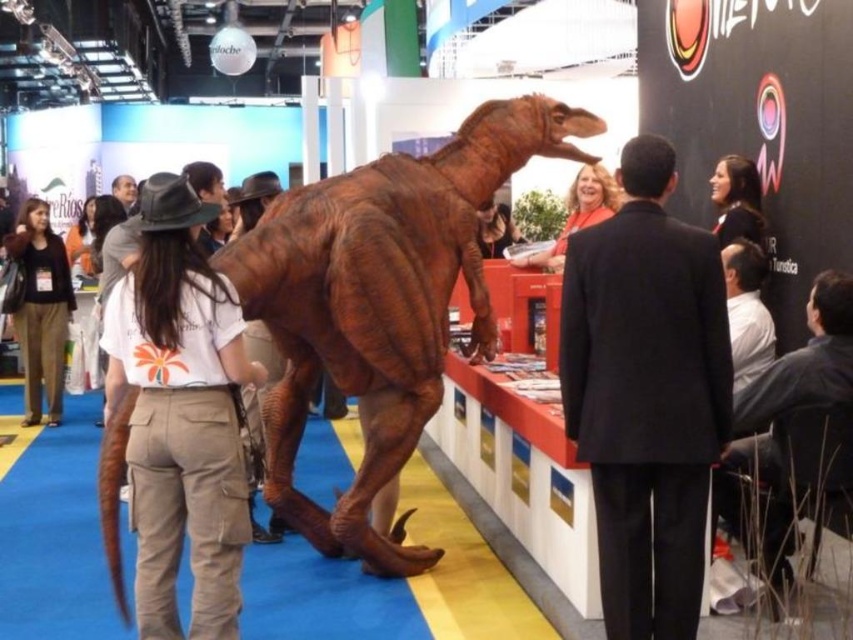
In the scene shown: You are at the exhibition and want to take a photo of the brown matte dinosaur tail at lower left and the matte black shirt at upper right. Which object should you focus on first if you want to capture both in the same frame without moving the camera?

The brown matte dinosaur tail at lower left is taller than the matte black shirt at upper right, so you should focus on the brown matte dinosaur tail at lower left first to ensure it fits in the frame.

You are organizing a photo shoot and need to ensure that both the brown textured dinosaur at center and the black suit at center can fit side by side within a 3 meter wide backdrop. Based on their widths, will they fit?

The brown textured dinosaur at center is wider than the black suit at center. Since the total width of both objects combined may exceed 3 meters, it is uncertain without exact measurements. However, according to the description, the dinosaur is wider but the exact dimensions are not provided. Therefore, it is possible they might not fit, but we cannot confirm without more information.

You are standing at the entrance of the exhibition hall and want to take a photo of the dinosaur model. The camera you are using has a focal length of 50mm and a sensor size of 24mm x 36mm. The point you are focusing on is point (154, 291). Given that the depth of field formula is 2 multiplied by the focal length multiplied by the circle of confusion divided by the aperture, and the circle of confusion for this camera is 0.03mm, what is the minimum aperture required to ensure the entire dinosaur model is

The distance of point (154, 291) from camera is 2.68 meters. To calculate the minimum aperture required, use the depth of field formula. However, without knowing the size of the dinosaur model or the acceptable sharpness range, an exact calculation cannot be determined. The provided information only specifies the distance to the focus point, not the object dimensions or desired sharpness limits. Therefore, the question cannot be fully answered with the given data.